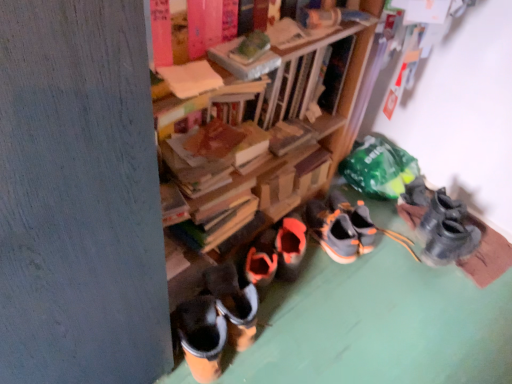
Where is `vacant area on top of orange rubber boots at lower left (from a real-world perspective)`? vacant area on top of orange rubber boots at lower left (from a real-world perspective) is located at coordinates (373, 294).